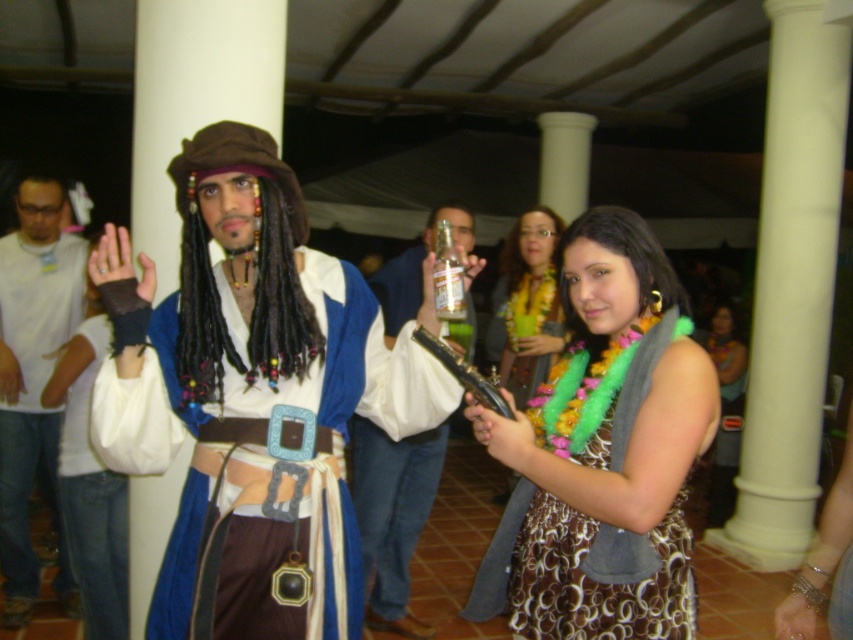
How far apart are fluffy green lei at center and white cotton shirt at left?

fluffy green lei at center is 2.23 meters away from white cotton shirt at left.

Can you confirm if fluffy green lei at center is positioned above white cotton shirt at left?

Yes, fluffy green lei at center is above white cotton shirt at left.

Measure the distance between point (x=633, y=509) and camera.

1.39 meters

Find the location of a particular element. fluffy green lei at center is located at coordinates (602, 452).

Is matte plastic bottle at center to the right of fluffy green boa at center from the viewer's perspective?

Incorrect, matte plastic bottle at center is not on the right side of fluffy green boa at center.

Which is more to the left, matte plastic bottle at center or fluffy green boa at center?

matte plastic bottle at center

Between point (410, 534) and point (527, 339), which one is positioned behind?

The point (527, 339) is behind.

You are a GUI agent. You are given a task and a screenshot of the screen. Output one action in this format:
    pyautogui.click(x=<x>, y=<y>)
    Task: Click on the matte plastic bottle at center
    
    Given the screenshot: What is the action you would take?
    pyautogui.click(x=393, y=515)

Which of these two, matte blue fabric shirt at center or fluffy green lei at center, stands shorter?

Standing shorter between the two is fluffy green lei at center.

Is point (230, 403) positioned in front of point (527, 417)?

That is True.

What are the coordinates of `matte blue fabric shirt at center` in the screenshot? It's located at (252, 390).